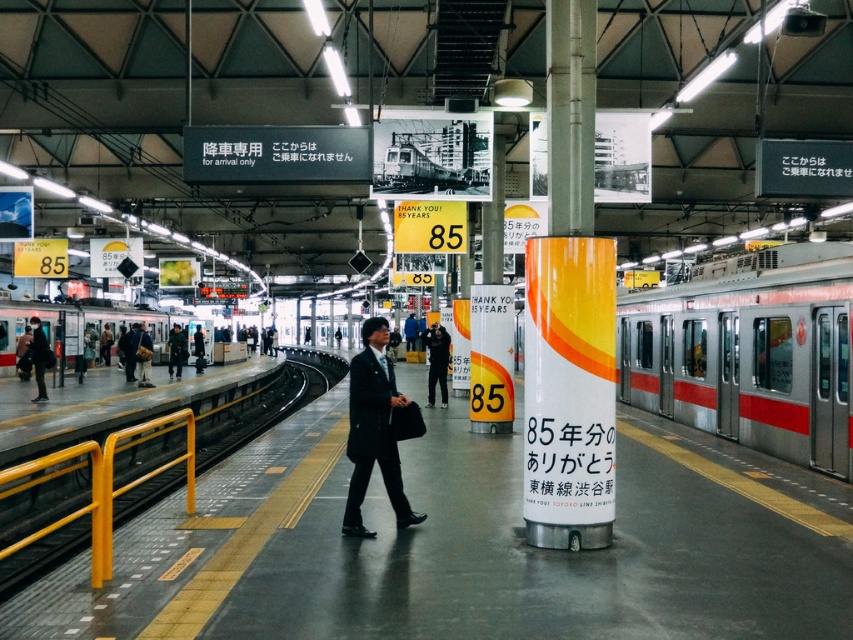
Question: Which of the following is the farthest from the observer?

Choices:
 (A) black suit at center
 (B) orange glossy pole at center

Answer: (A)

Question: Where is smooth concrete platform at center located in relation to silver metallic train at right in the image?

Choices:
 (A) left
 (B) right

Answer: (A)

Question: Can you confirm if orange glossy pole at center is wider than silver metallic train at left?

Choices:
 (A) no
 (B) yes

Answer: (A)

Question: Which point is farther from the camera taking this photo?

Choices:
 (A) (392, 451)
 (B) (70, 337)

Answer: (B)

Question: Does silver metallic train at right have a lesser width compared to silver metallic train at left?

Choices:
 (A) yes
 (B) no

Answer: (B)

Question: Based on their relative distances, which object is nearer to the black suit at center?

Choices:
 (A) orange glossy pole at center
 (B) silver metallic train at right
 (C) silver metallic train at left
 (D) smooth concrete platform at center

Answer: (A)